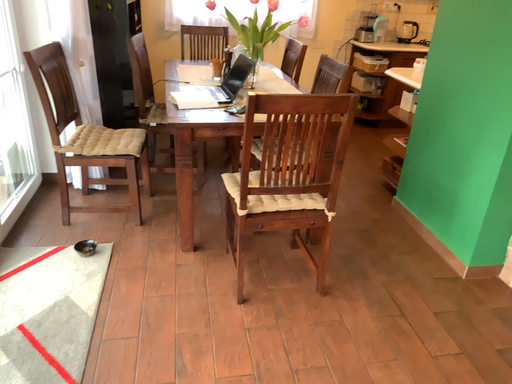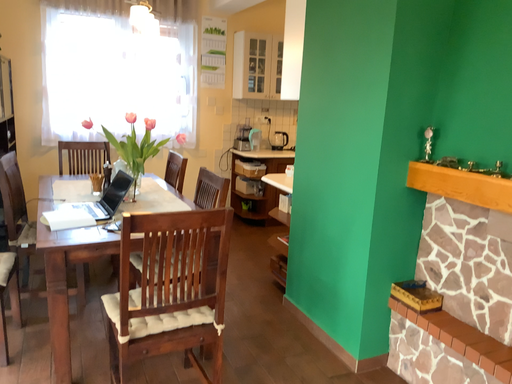
Question: How did the camera likely rotate when shooting the video?

Choices:
 (A) rotated upward
 (B) rotated downward

Answer: (A)